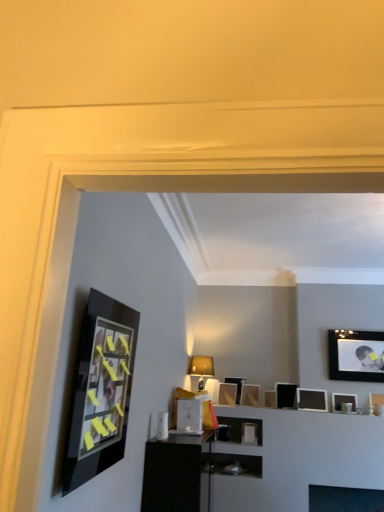
Question: Is the position of matte black picture frame at center, which is counted as the third picture frame, starting from the back, more distant than that of matte gold lampshade at center?

Choices:
 (A) yes
 (B) no

Answer: (A)

Question: From the image's perspective, is matte black picture frame at center, arranged as the 7th picture frame when viewed from the front, below matte gold lampshade at center?

Choices:
 (A) no
 (B) yes

Answer: (B)

Question: Does matte black picture frame at center, which is counted as the third picture frame, starting from the back, appear on the right side of matte gold lampshade at center?

Choices:
 (A) no
 (B) yes

Answer: (B)

Question: Does matte black picture frame at center, which is counted as the third picture frame, starting from the back, have a greater width compared to matte gold lampshade at center?

Choices:
 (A) no
 (B) yes

Answer: (A)

Question: Could you tell me if matte black picture frame at center, arranged as the third picture frame when viewed from the left, is facing matte gold lampshade at center?

Choices:
 (A) yes
 (B) no

Answer: (B)

Question: In terms of size, does matte black picture frame at center, which ranks as the 5th picture frame in right-to-left order, appear bigger or smaller than matte black picture frame at upper right, the seventh picture frame when ordered from left to right?

Choices:
 (A) big
 (B) small

Answer: (A)

Question: Is matte black picture frame at center, which is the second picture frame from back to front, in front of or behind matte black picture frame at upper right, the 6th picture frame in the back-to-front sequence, in the image?

Choices:
 (A) behind
 (B) front

Answer: (A)

Question: Is matte black picture frame at center, marked as the eighth picture frame in a front-to-back arrangement, inside or outside of matte black picture frame at upper right, which appears as the 4th picture frame when viewed from the front?

Choices:
 (A) outside
 (B) inside

Answer: (A)

Question: Considering the relative positions of matte black picture frame at center, marked as the eighth picture frame in a front-to-back arrangement, and matte black picture frame at upper right, which appears as the 4th picture frame when viewed from the front, in the image provided, is matte black picture frame at center, marked as the eighth picture frame in a front-to-back arrangement, to the left or to the right of matte black picture frame at upper right, which appears as the 4th picture frame when viewed from the front,?

Choices:
 (A) right
 (B) left

Answer: (B)

Question: From a real-world perspective, relative to matte black picture frame at upper right, which is the fifth picture frame from back to front, is metallic silver picture frame at center, acting as the eighth picture frame starting from the right, vertically above or below?

Choices:
 (A) above
 (B) below

Answer: (B)

Question: Considering the positions of point (196, 408) and point (301, 398), is point (196, 408) closer or farther from the camera than point (301, 398)?

Choices:
 (A) closer
 (B) farther

Answer: (A)

Question: Is metallic silver picture frame at center, which is counted as the 2th picture frame, starting from the front, in front of or behind matte black picture frame at upper right, which is the fifth picture frame from back to front, in the image?

Choices:
 (A) front
 (B) behind

Answer: (A)

Question: Based on their positions, is metallic silver picture frame at center, which is counted as the 2th picture frame, starting from the front, located to the left or right of matte black picture frame at upper right, which is the sixth picture frame in left-to-right order?

Choices:
 (A) right
 (B) left

Answer: (B)

Question: In terms of height, does matte black picture frame at upper right, marked as the 3th picture frame in a front-to-back arrangement, look taller or shorter compared to matte black picture frame at center, arranged as the 7th picture frame when viewed from the front?

Choices:
 (A) tall
 (B) short

Answer: (B)

Question: Visually, is matte black picture frame at upper right, the 7th picture frame when ordered from back to front, positioned to the left or to the right of matte black picture frame at center, arranged as the third picture frame when viewed from the left?

Choices:
 (A) left
 (B) right

Answer: (B)